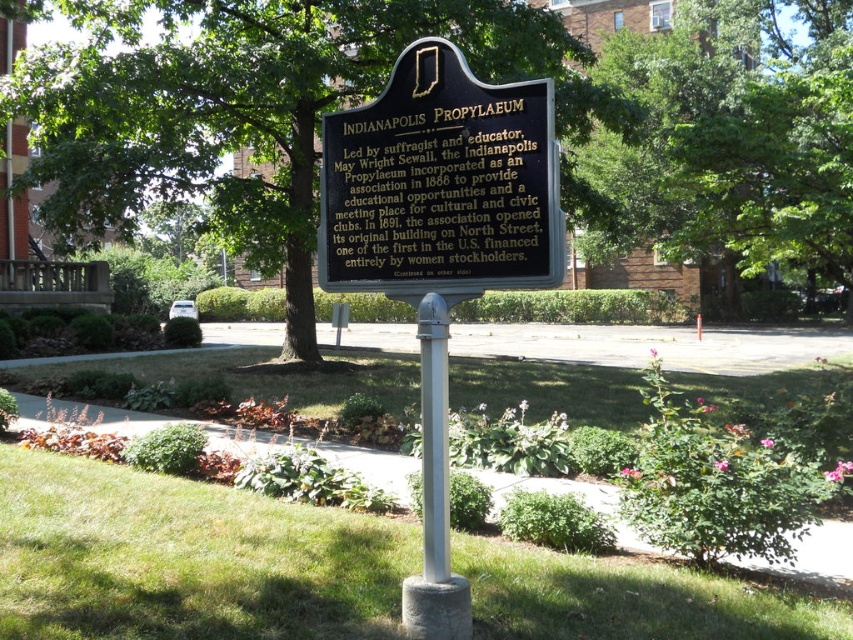
Can you confirm if black metal plaque at center is taller than silver metallic pole at center?

No, black metal plaque at center is not taller than silver metallic pole at center.

Can you confirm if black metal plaque at center is positioned to the left of silver metallic pole at center?

Incorrect, black metal plaque at center is not on the left side of silver metallic pole at center.

Is point (445, 99) closer to viewer compared to point (430, 296)?

Yes, point (445, 99) is in front of point (430, 296).

In order to click on black metal plaque at center in this screenshot , I will do `click(440, 188)`.

Is green leafy tree at center smaller than green leafy tree at upper center?

Yes, green leafy tree at center is smaller than green leafy tree at upper center.

From the picture: Does green leafy tree at center have a lesser width compared to green leafy tree at upper center?

Yes.

Who is more distant from viewer, (x=175, y=148) or (x=770, y=45)?

The point (x=770, y=45) is more distant.

Where is `green leafy tree at center`? Image resolution: width=853 pixels, height=640 pixels. green leafy tree at center is located at coordinates (254, 108).

How distant is green leafy tree at upper center from silver metallic pole at center?

The distance of green leafy tree at upper center from silver metallic pole at center is 26.24 meters.

The width and height of the screenshot is (853, 640). What are the coordinates of `green leafy tree at upper center` in the screenshot? It's located at (735, 138).

At what (x,y) coordinates should I click in order to perform the action: click on green leafy tree at upper center. Please return your answer as a coordinate pair (x, y). Image resolution: width=853 pixels, height=640 pixels. Looking at the image, I should click on (735, 138).